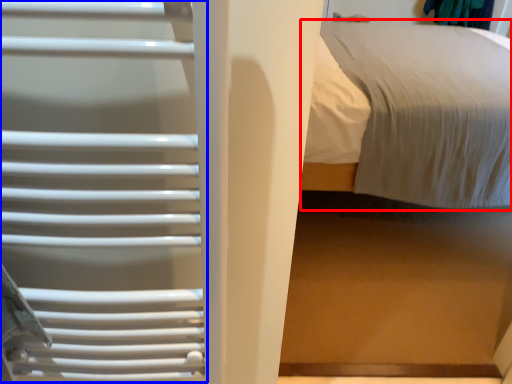
Question: Among these objects, which one is farthest to the camera, bed (highlighted by a red box) or cage (highlighted by a blue box)?

Choices:
 (A) bed
 (B) cage

Answer: (A)